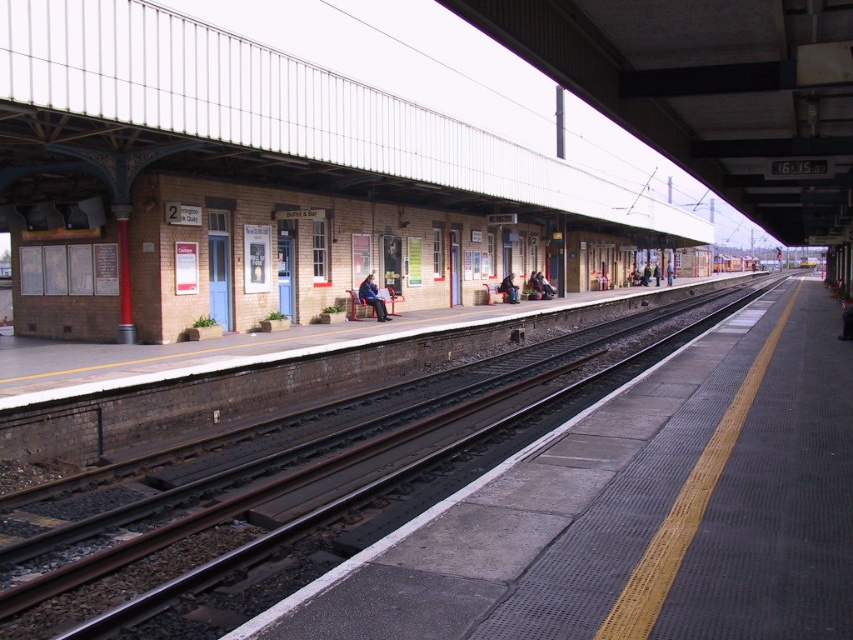
In the scene shown: You are a passenger on the platform and want to place your blue denim jacket at center on the brown wooden track at center. Will the jacket fit on the track?

The brown wooden track at center is bigger than blue denim jacket at center, so the jacket will fit on the track.

You are standing on the platform and need to reach the blue denim jacket at center quickly. The brown wooden track at center is in your way. Can you walk around it? Please explain why.

The brown wooden track at center is 6.40 meters away from the blue denim jacket at center. Since the track is only 6.40 meters away from the jacket, you can easily walk around it to reach the jacket quickly.